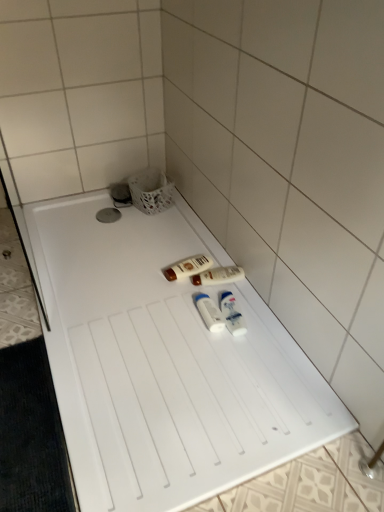
Find the location of a particular element. free point to the right of white plastic tubes at center, placed as the 3th toiletry when sorted from back to front is located at coordinates (257, 325).